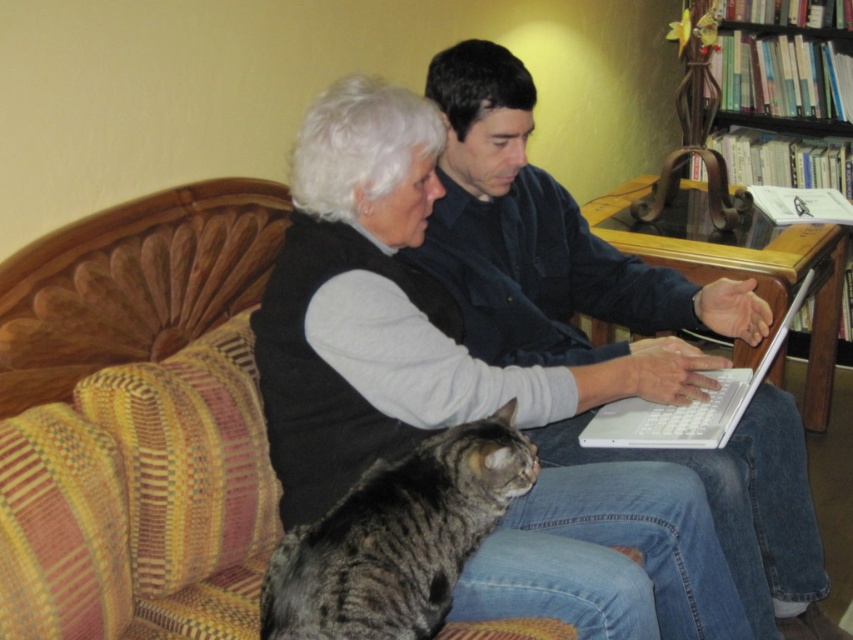
Question: Is the position of tabby fur cat at lower left more distant than that of white plastic laptop at center?

Choices:
 (A) yes
 (B) no

Answer: (B)

Question: Can you confirm if tabby fur cat at lower left is positioned to the left of wooden bookshelf at upper right?

Choices:
 (A) no
 (B) yes

Answer: (B)

Question: Which object is closer to the camera taking this photo?

Choices:
 (A) wooden bookshelf at upper right
 (B) yellow striped fabric couch at center
 (C) white plastic laptop at center
 (D) matte black shirt at center

Answer: (B)

Question: Is matte black shirt at center smaller than tabby fur cat at lower left?

Choices:
 (A) yes
 (B) no

Answer: (B)

Question: Which point is closer to the camera?

Choices:
 (A) matte black shirt at center
 (B) tabby fur cat at lower left
 (C) yellow striped fabric couch at center
 (D) white plastic laptop at center

Answer: (B)

Question: Estimate the real-world distances between objects in this image. Which object is closer to the wooden bookshelf at upper right?

Choices:
 (A) tabby fur cat at lower left
 (B) yellow striped fabric couch at center

Answer: (A)